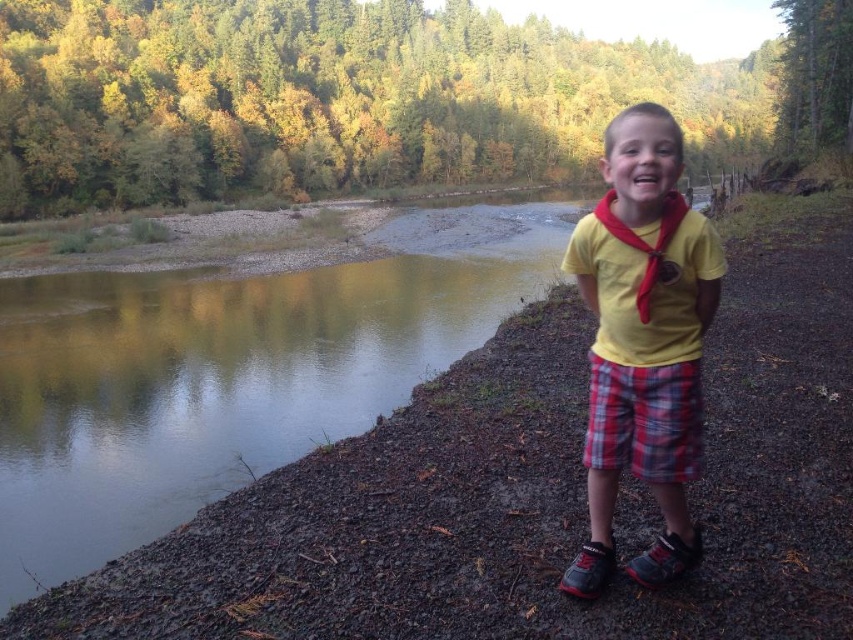
Question: Which point is farther from the camera taking this photo?

Choices:
 (A) (664, 547)
 (B) (25, 330)
 (C) (618, 456)

Answer: (B)

Question: Does green reflective water at lower left lie in front of yellow cotton shirt at center?

Choices:
 (A) no
 (B) yes

Answer: (A)

Question: Can you confirm if yellow cotton shirt at center is smaller than plaid fabric shorts at right?

Choices:
 (A) yes
 (B) no

Answer: (B)

Question: Which point is closer to the camera?

Choices:
 (A) yellow cotton shirt at center
 (B) plaid fabric shorts at right

Answer: (A)

Question: Which point is closer to the camera?

Choices:
 (A) plaid fabric shorts at right
 (B) green reflective water at lower left
 (C) yellow cotton shirt at center

Answer: (C)

Question: Can you confirm if green reflective water at lower left is positioned to the left of yellow cotton shirt at center?

Choices:
 (A) no
 (B) yes

Answer: (B)